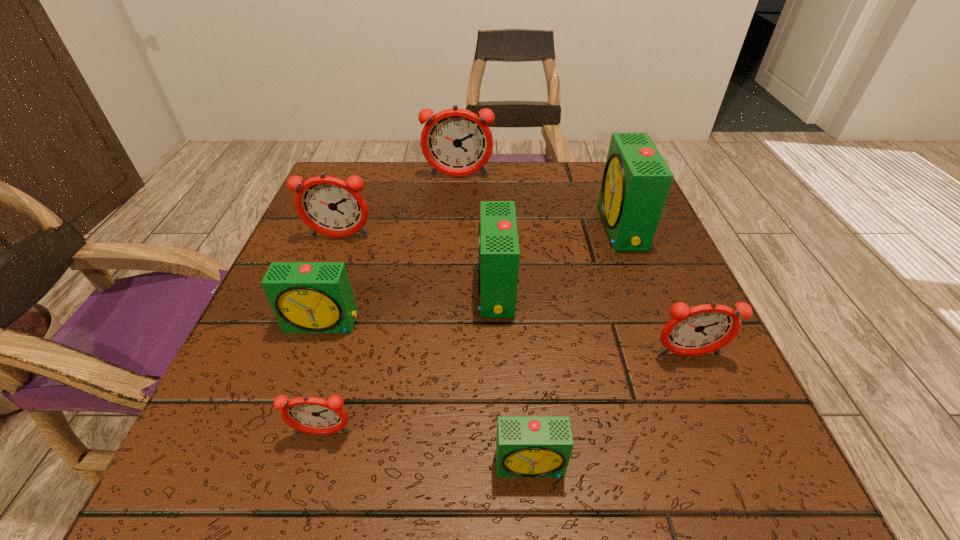
Image resolution: width=960 pixels, height=540 pixels. In order to click on the smallest reddish-pink alarm clock in this screenshot , I will do `click(312, 415)`.

Where is `the nearest green alarm clock`? the nearest green alarm clock is located at coordinates (527, 446).

Identify the location of the smallest green alarm clock. Image resolution: width=960 pixels, height=540 pixels. (527, 446).

At what (x,y) coordinates should I click in order to perform the action: click on vacant space located on the front-facing side of the biggest reddish-pink alarm clock. Please return your answer as a coordinate pair (x, y). This screenshot has height=540, width=960. Looking at the image, I should click on tap(452, 261).

At what (x,y) coordinates should I click in order to perform the action: click on vacant space located on the front-facing side of the farthest green alarm clock. Please return your answer as a coordinate pair (x, y). Looking at the image, I should click on (534, 227).

At what (x,y) coordinates should I click in order to perform the action: click on vacant region located 0.150m on the front-facing side of the farthest green alarm clock. Please return your answer as a coordinate pair (x, y). The image size is (960, 540). Looking at the image, I should click on (534, 227).

Where is `free space located on the front-facing side of the farthest green alarm clock`? The width and height of the screenshot is (960, 540). free space located on the front-facing side of the farthest green alarm clock is located at coordinates (464, 227).

This screenshot has height=540, width=960. What are the coordinates of `vacant space located on the front-facing side of the second farthest reddish-pink alarm clock` in the screenshot? It's located at (293, 362).

At what (x,y) coordinates should I click in order to perform the action: click on free spot located on the front-facing side of the third smallest green alarm clock. Please return your answer as a coordinate pair (x, y). This screenshot has width=960, height=540. Looking at the image, I should click on (287, 290).

At what (x,y) coordinates should I click in order to perform the action: click on vacant area situated 0.180m on the front-facing side of the third smallest green alarm clock. Please return your answer as a coordinate pair (x, y). The image size is (960, 540). Looking at the image, I should click on (380, 290).